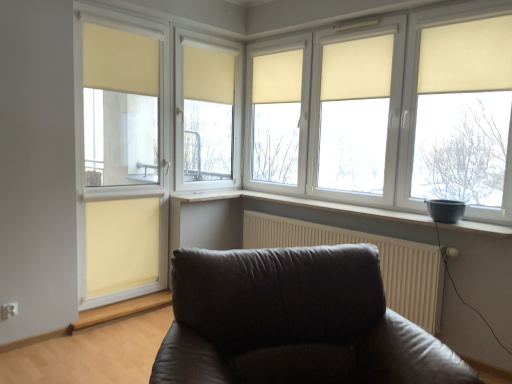
Image resolution: width=512 pixels, height=384 pixels. I want to click on free space above beige fabric curtain at center, acting as the third curtain starting from the right (from a real-world perspective), so click(x=282, y=44).